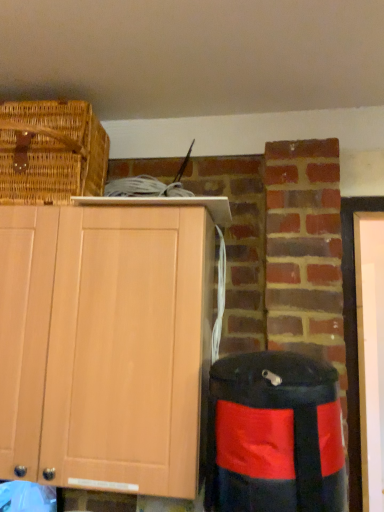
Measure the distance between black fabric trash bin/can at lower right and camera.

black fabric trash bin/can at lower right is 33.39 inches away from camera.

Identify the location of light wood cabinet at upper left. The width and height of the screenshot is (384, 512). coord(105,346).

Considering the sizes of objects light wood cabinet at upper left and woven brown picnic basket at upper left in the image provided, who is taller, light wood cabinet at upper left or woven brown picnic basket at upper left?

light wood cabinet at upper left.

Looking at this image, does light wood cabinet at upper left touch woven brown picnic basket at upper left?

No, light wood cabinet at upper left is not beside woven brown picnic basket at upper left.

Consider the image. Is black fabric trash bin/can at lower right taller or shorter than light wood cabinet at upper left?

In the image, black fabric trash bin/can at lower right appears to be shorter than light wood cabinet at upper left.

Who is smaller, black fabric trash bin/can at lower right or light wood cabinet at upper left?

With smaller size is black fabric trash bin/can at lower right.

Considering the positions of points (304, 428) and (35, 471), is point (304, 428) closer to camera compared to point (35, 471)?

Yes, it is in front of point (35, 471).

Is black fabric trash bin/can at lower right to the left of light wood cabinet at upper left from the viewer's perspective?

No, black fabric trash bin/can at lower right is not to the left of light wood cabinet at upper left.

Between light wood cabinet at upper left and black fabric trash bin/can at lower right, which one has more height?

Standing taller between the two is light wood cabinet at upper left.

From the picture: From the image's perspective, which one is positioned higher, light wood cabinet at upper left or black fabric trash bin/can at lower right?

light wood cabinet at upper left, from the image's perspective.

From a real-world perspective, relative to black fabric trash bin/can at lower right, is light wood cabinet at upper left vertically above or below?

light wood cabinet at upper left is above black fabric trash bin/can at lower right.

Which point is more forward, (x=71, y=296) or (x=250, y=473)?

The point (x=250, y=473) is more forward.

Can you tell me how much woven brown picnic basket at upper left and black fabric trash bin/can at lower right differ in facing direction?

The angular difference between woven brown picnic basket at upper left and black fabric trash bin/can at lower right is 0.0564 degrees.

Is the surface of woven brown picnic basket at upper left in direct contact with black fabric trash bin/can at lower right?

woven brown picnic basket at upper left and black fabric trash bin/can at lower right are clearly separated.

From a real-world perspective, which is physically above, woven brown picnic basket at upper left or black fabric trash bin/can at lower right?

In real-world perspective, woven brown picnic basket at upper left is above.

Identify the location of trash bin/can that appears below the woven brown picnic basket at upper left (from the image's perspective). The height and width of the screenshot is (512, 384). (274, 435).

Based on the photo, is woven brown picnic basket at upper left not inside light wood cabinet at upper left?

Indeed, woven brown picnic basket at upper left is completely outside light wood cabinet at upper left.

Is woven brown picnic basket at upper left with light wood cabinet at upper left?

No, woven brown picnic basket at upper left is not touching light wood cabinet at upper left.

Is woven brown picnic basket at upper left facing towards light wood cabinet at upper left?

No, woven brown picnic basket at upper left is not facing towards light wood cabinet at upper left.

Which of these two, woven brown picnic basket at upper left or light wood cabinet at upper left, is thinner?

light wood cabinet at upper left is thinner.

Would you say woven brown picnic basket at upper left is part of black fabric trash bin/can at lower right's contents?

No, black fabric trash bin/can at lower right does not contain woven brown picnic basket at upper left.

Can you confirm if black fabric trash bin/can at lower right is wider than woven brown picnic basket at upper left?

In fact, black fabric trash bin/can at lower right might be narrower than woven brown picnic basket at upper left.

Who is bigger, black fabric trash bin/can at lower right or woven brown picnic basket at upper left?

Bigger between the two is woven brown picnic basket at upper left.

Find the location of a particular element. The height and width of the screenshot is (512, 384). trash bin/can on the right of woven brown picnic basket at upper left is located at coordinates 274,435.

This screenshot has width=384, height=512. Find the location of `picnic basket behind the light wood cabinet at upper left`. picnic basket behind the light wood cabinet at upper left is located at coordinates (51, 152).

You are a GUI agent. You are given a task and a screenshot of the screen. Output one action in this format:
    pyautogui.click(x=<x>, y=<y>)
    Task: Click on the trash bin/can lying below the light wood cabinet at upper left (from the image's perspective)
    
    Given the screenshot: What is the action you would take?
    pyautogui.click(x=274, y=435)

Based on their spatial positions, is black fabric trash bin/can at lower right or light wood cabinet at upper left closer to woven brown picnic basket at upper left?

Based on the image, light wood cabinet at upper left appears to be nearer to woven brown picnic basket at upper left.

Looking at the image, which one is located closer to black fabric trash bin/can at lower right, woven brown picnic basket at upper left or light wood cabinet at upper left?

light wood cabinet at upper left lies closer to black fabric trash bin/can at lower right than the other object.

Consider the image. From the image, which object appears to be nearer to black fabric trash bin/can at lower right, light wood cabinet at upper left or woven brown picnic basket at upper left?

light wood cabinet at upper left.

From the image, which object appears to be farther from woven brown picnic basket at upper left, light wood cabinet at upper left or black fabric trash bin/can at lower right?

The object further to woven brown picnic basket at upper left is black fabric trash bin/can at lower right.

Estimate the real-world distances between objects in this image. Which object is closer to light wood cabinet at upper left, black fabric trash bin/can at lower right or woven brown picnic basket at upper left?

The object closer to light wood cabinet at upper left is black fabric trash bin/can at lower right.

Based on their spatial positions, is woven brown picnic basket at upper left or black fabric trash bin/can at lower right further from light wood cabinet at upper left?

Based on the image, woven brown picnic basket at upper left appears to be further to light wood cabinet at upper left.

At what (x,y) coordinates should I click in order to perform the action: click on cabinetry between woven brown picnic basket at upper left and black fabric trash bin/can at lower right in the up-down direction. Please return your answer as a coordinate pair (x, y). This screenshot has width=384, height=512. Looking at the image, I should click on (105, 346).